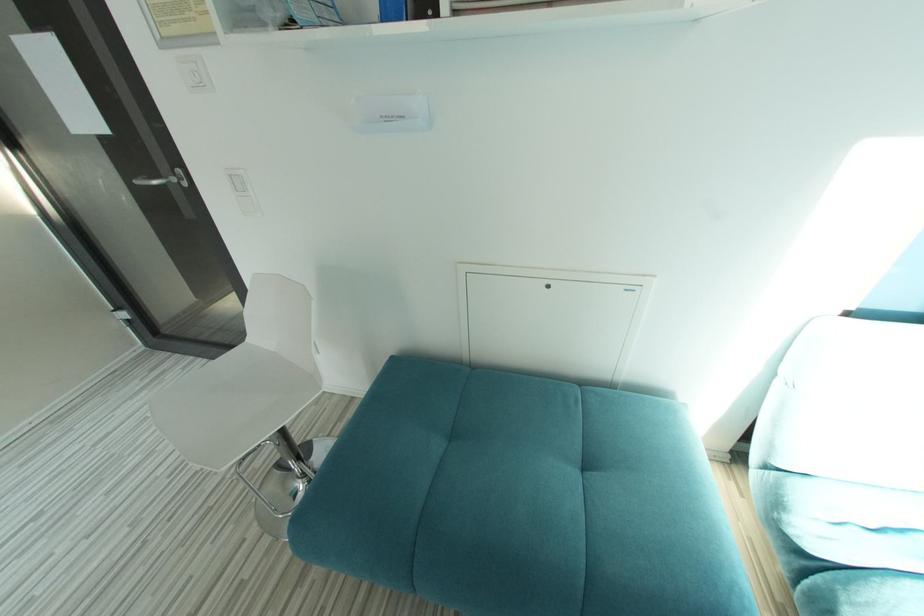
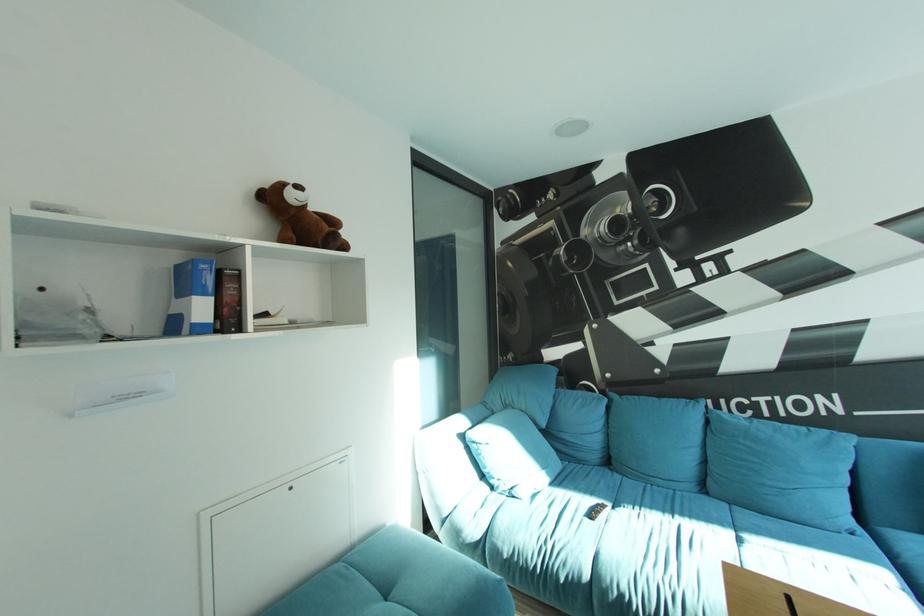
Question: Based on the continuous images, in which direction is the camera rotating? Reply with the corresponding letter.

Choices:
 (A) Left
 (B) Right
 (C) Up
 (D) Down

Answer: (B)